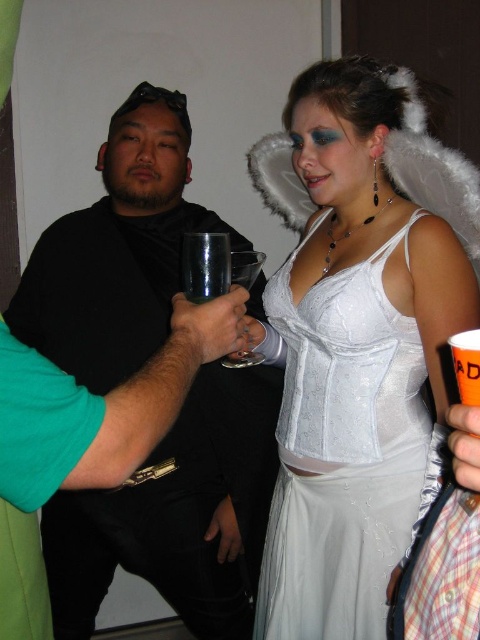
Question: Which point is closer to the camera taking this photo?

Choices:
 (A) (361, 412)
 (B) (141, 557)

Answer: (A)

Question: Among these points, which one is nearest to the camera?

Choices:
 (A) (290, 627)
 (B) (59, 620)

Answer: (A)

Question: Does black matte shirt at left appear under satin white dress at center?

Choices:
 (A) yes
 (B) no

Answer: (B)

Question: Which point appears closest to the camera in this image?

Choices:
 (A) (286, 445)
 (B) (158, 268)

Answer: (A)

Question: Does black matte shirt at left have a greater width compared to satin white dress at center?

Choices:
 (A) no
 (B) yes

Answer: (B)

Question: Is black matte shirt at left smaller than satin white dress at center?

Choices:
 (A) yes
 (B) no

Answer: (B)